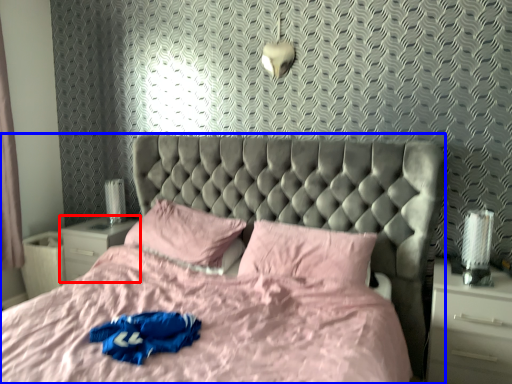
Question: Which object appears closest to the camera in this image, nightstand (highlighted by a red box) or bed (highlighted by a blue box)?

Choices:
 (A) nightstand
 (B) bed

Answer: (B)